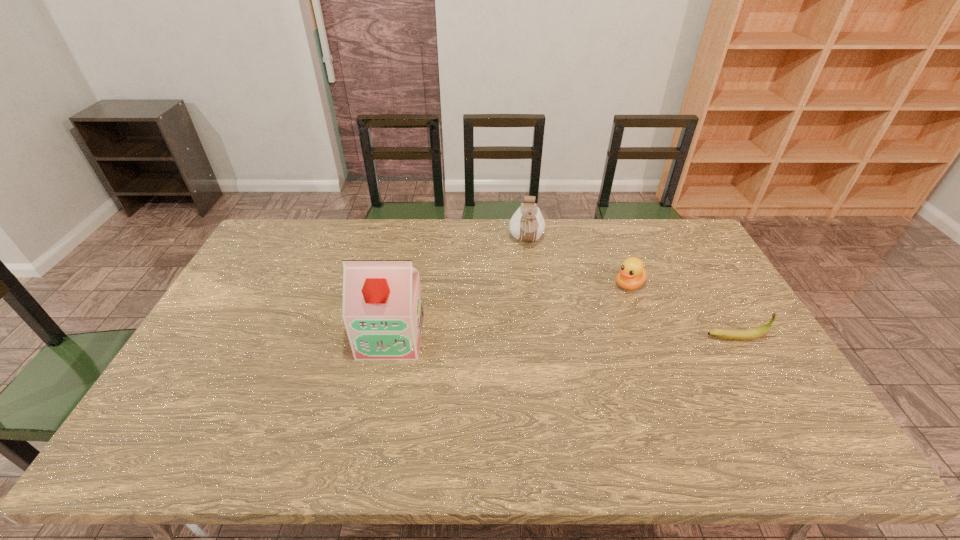
Identify the location of vacant space located 0.370m on the face of the third nearest object. Image resolution: width=960 pixels, height=540 pixels. (540, 350).

Find the location of `free space located 0.190m on the front-facing side of the second object from left to right`. free space located 0.190m on the front-facing side of the second object from left to right is located at coordinates (531, 291).

You are a GUI agent. You are given a task and a screenshot of the screen. Output one action in this format:
    pyautogui.click(x=<x>, y=<y>)
    Task: Click on the vacant space positioned on the front-facing side of the second object from left to right
    
    Given the screenshot: What is the action you would take?
    pyautogui.click(x=531, y=298)

This screenshot has width=960, height=540. Find the location of `blank area located 0.300m on the front-facing side of the second object from left to right`. blank area located 0.300m on the front-facing side of the second object from left to right is located at coordinates (533, 316).

Locate an element on the screen. This screenshot has height=540, width=960. object that is at the far edge is located at coordinates (527, 224).

Where is `object that is at the right edge`? The image size is (960, 540). object that is at the right edge is located at coordinates (739, 335).

In the image, there is a desktop. Where is `vacant space at the far edge`? The width and height of the screenshot is (960, 540). vacant space at the far edge is located at coordinates pos(479,252).

Where is `vacant space at the near edge of the desktop`? The width and height of the screenshot is (960, 540). vacant space at the near edge of the desktop is located at coordinates (461, 406).

Identify the location of free region at the left edge of the desktop. (261, 302).

Locate an element on the screen. This screenshot has height=540, width=960. vacant space at the right edge is located at coordinates (765, 379).